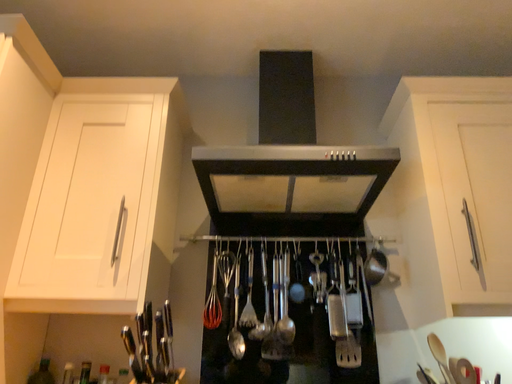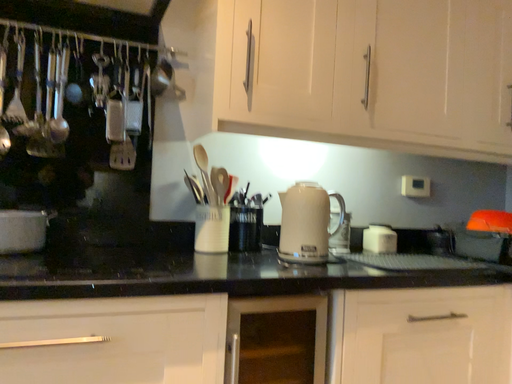
Question: Which way did the camera rotate in the video?

Choices:
 (A) rotated upward
 (B) rotated downward

Answer: (B)